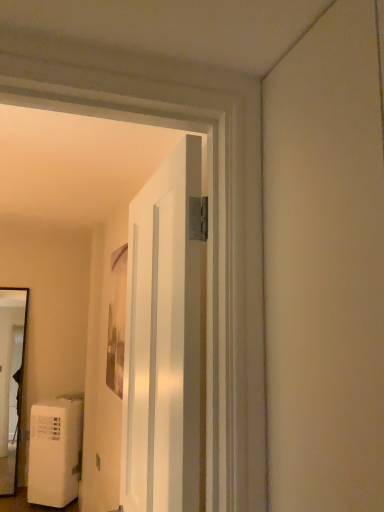
Question: Is the position of white matte water heater at lower left less distant than that of white glossy door at center?

Choices:
 (A) yes
 (B) no

Answer: (B)

Question: Is white matte water heater at lower left thinner than white glossy door at center?

Choices:
 (A) yes
 (B) no

Answer: (B)

Question: Can you confirm if white matte water heater at lower left is smaller than white glossy door at center?

Choices:
 (A) no
 (B) yes

Answer: (A)

Question: Is white matte water heater at lower left wider than white glossy door at center?

Choices:
 (A) no
 (B) yes

Answer: (B)

Question: Could you tell me if white matte water heater at lower left is turned towards white glossy door at center?

Choices:
 (A) yes
 (B) no

Answer: (B)

Question: Is white matte water heater at lower left placed right next to white glossy door at center?

Choices:
 (A) no
 (B) yes

Answer: (A)

Question: Can you confirm if matte wooden picture frame at center is taller than white matte water heater at lower left?

Choices:
 (A) yes
 (B) no

Answer: (A)

Question: From the image's perspective, is matte wooden picture frame at center on white matte water heater at lower left?

Choices:
 (A) yes
 (B) no

Answer: (A)

Question: Is matte wooden picture frame at center to the right of white matte water heater at lower left from the viewer's perspective?

Choices:
 (A) yes
 (B) no

Answer: (A)

Question: Is matte wooden picture frame at center thinner than white matte water heater at lower left?

Choices:
 (A) yes
 (B) no

Answer: (A)

Question: From a real-world perspective, is matte wooden picture frame at center beneath white matte water heater at lower left?

Choices:
 (A) yes
 (B) no

Answer: (B)

Question: Is matte wooden picture frame at center positioned before white matte water heater at lower left?

Choices:
 (A) no
 (B) yes

Answer: (B)

Question: Is white glossy door at center to the left of matte wooden picture frame at center from the viewer's perspective?

Choices:
 (A) yes
 (B) no

Answer: (B)